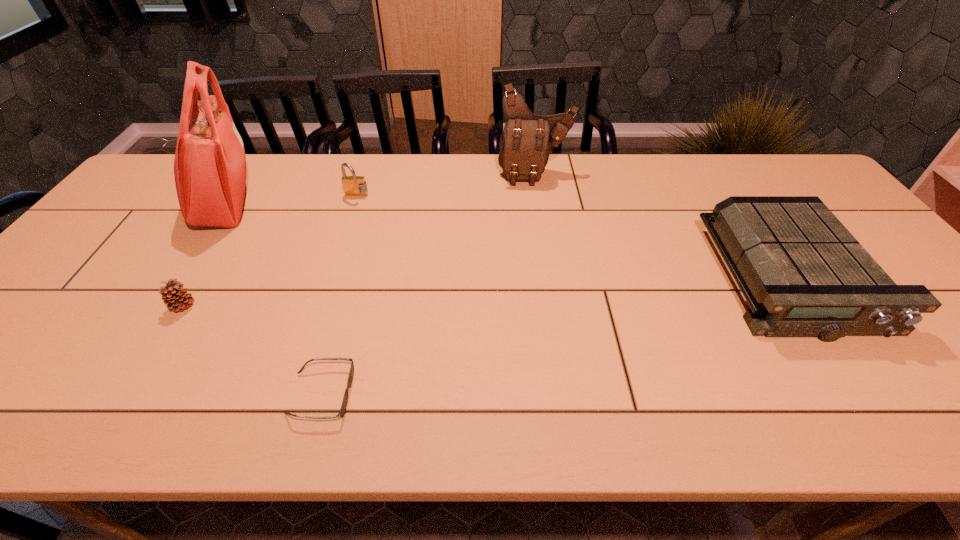
In the image, there is a desktop. At what (x,y) coordinates should I click in order to perform the action: click on vacant space at the near edge. Please return your answer as a coordinate pair (x, y). Looking at the image, I should click on pos(752,425).

In the image, there is a desktop. At what (x,y) coordinates should I click in order to perform the action: click on free space at the left edge. Please return your answer as a coordinate pair (x, y). The height and width of the screenshot is (540, 960). Looking at the image, I should click on (166, 204).

Where is `free space at the near left corner of the desktop`? This screenshot has height=540, width=960. free space at the near left corner of the desktop is located at coordinates (32, 389).

Locate an element on the screen. This screenshot has height=540, width=960. empty space that is in between the sunglasses and the padlock is located at coordinates (339, 295).

Locate an element on the screen. free spot between the second object from right to left and the tallest object is located at coordinates (380, 188).

Where is `free space between the tallest object and the pinecone`? The width and height of the screenshot is (960, 540). free space between the tallest object and the pinecone is located at coordinates pyautogui.click(x=204, y=255).

The width and height of the screenshot is (960, 540). I want to click on free space between the second shortest object and the fifth shortest object, so click(359, 240).

I want to click on vacant region between the pinecone and the tallest object, so click(x=204, y=255).

Where is `free space between the padlock and the fifth shortest object`? free space between the padlock and the fifth shortest object is located at coordinates (445, 185).

The width and height of the screenshot is (960, 540). What are the coordinates of `vacant space that is in between the second shortest object and the rightmost object` in the screenshot? It's located at (488, 293).